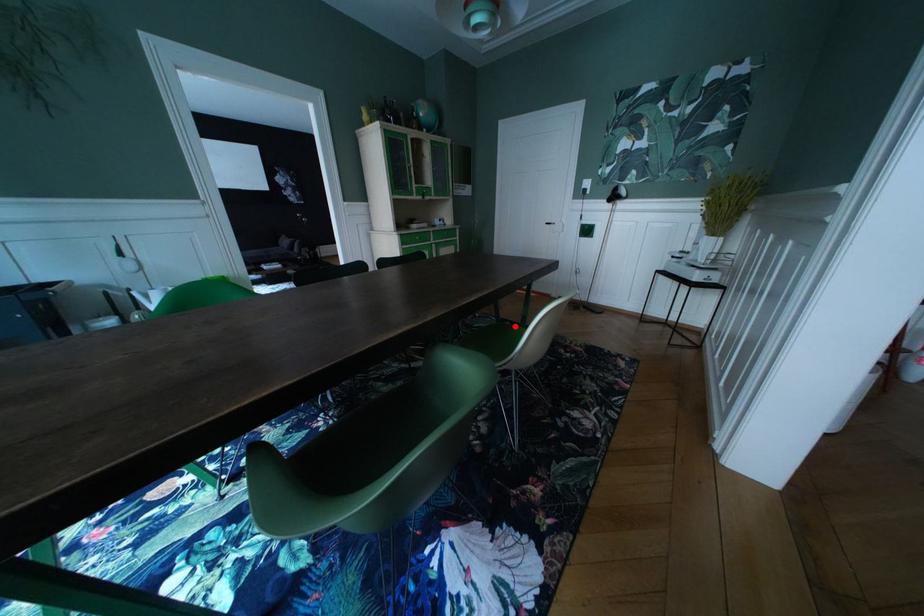
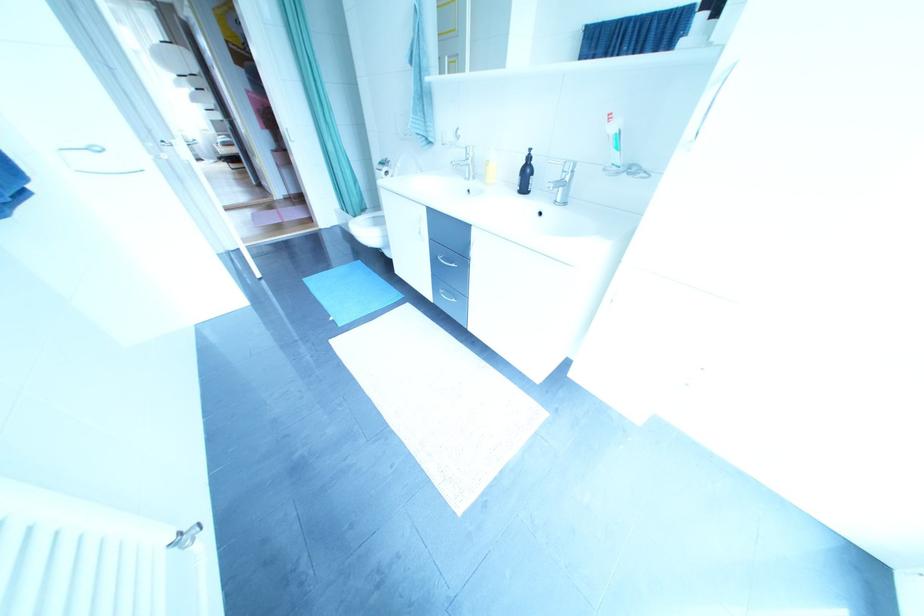
Question: I am providing you with two images of the same scene from different viewpoints. A red point is marked on the first image. Can you still see the location of the red point in image 2?

Choices:
 (A) Yes
 (B) No

Answer: (B)